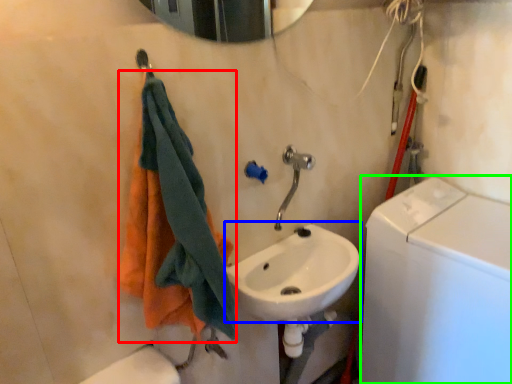
Question: Which is nearer to the towel (highlighted by a red box)? sink (highlighted by a blue box) or washing machine (highlighted by a green box).

Choices:
 (A) sink
 (B) washing machine

Answer: (A)